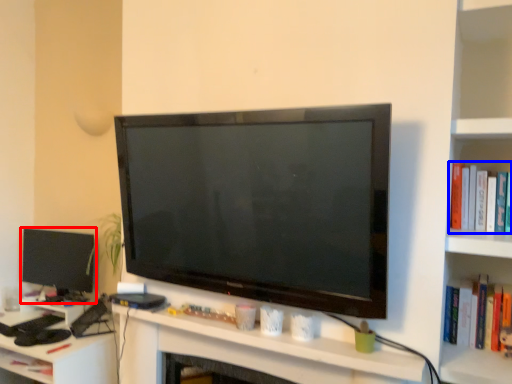
Question: Which object appears farthest to the camera in this image, television (highlighted by a red box) or book (highlighted by a blue box)?

Choices:
 (A) television
 (B) book

Answer: (A)